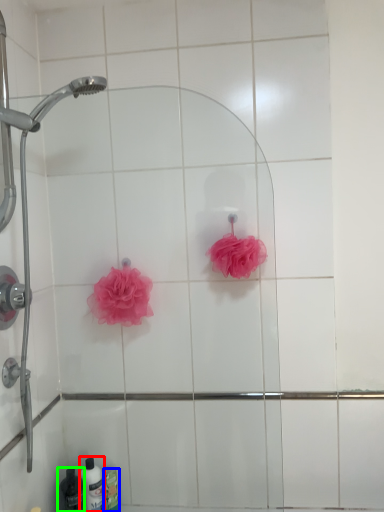
Question: Considering the real-world distances, which object is farthest from toiletry (highlighted by a red box)? toiletry (highlighted by a blue box) or toiletry (highlighted by a green box)?

Choices:
 (A) toiletry
 (B) toiletry

Answer: (B)